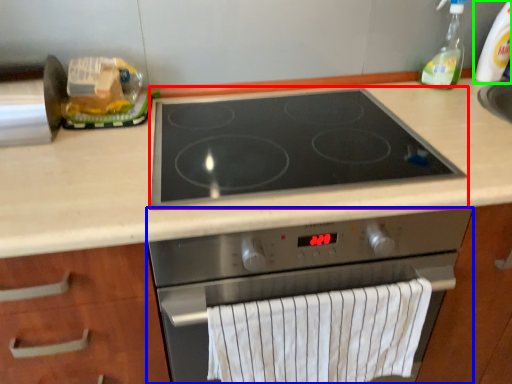
Question: Based on their relative distances, which object is farther from gas stove (highlighted by a red box)? Choose from kitchen appliance (highlighted by a blue box) and bottle (highlighted by a green box).

Choices:
 (A) kitchen appliance
 (B) bottle

Answer: (B)